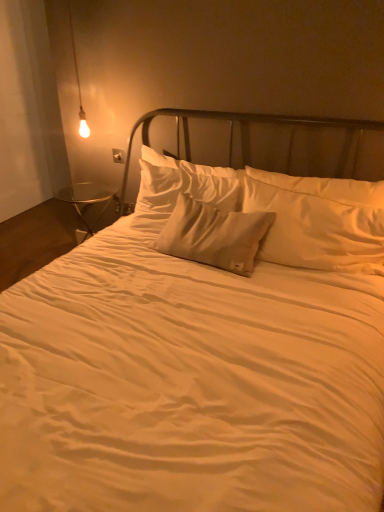
Question: Considering the relative positions of satin beige pillow at center, the 1th pillow viewed from the back, and matte plastic electric outlet at lower left, which is the 1th electric outlet in back-to-front order, in the image provided, is satin beige pillow at center, the 1th pillow viewed from the back, to the right of matte plastic electric outlet at lower left, which is the 1th electric outlet in back-to-front order, from the viewer's perspective?

Choices:
 (A) yes
 (B) no

Answer: (A)

Question: Is satin beige pillow at center, the 1th pillow viewed from the back, in front of matte plastic electric outlet at lower left, placed as the 1th electric outlet when sorted from bottom to top?

Choices:
 (A) no
 (B) yes

Answer: (B)

Question: Can we say satin beige pillow at center, the 1th pillow viewed from the back, lies outside matte plastic electric outlet at lower left, the second electric outlet from the top?

Choices:
 (A) yes
 (B) no

Answer: (A)

Question: Can you confirm if satin beige pillow at center, the 1th pillow viewed from the back, is thinner than matte plastic electric outlet at lower left, placed as the 1th electric outlet when sorted from bottom to top?

Choices:
 (A) yes
 (B) no

Answer: (B)

Question: From a real-world perspective, is satin beige pillow at center, placed as the 2th pillow when sorted from front to back, on top of matte plastic electric outlet at lower left, the 2th electric outlet viewed from the front?

Choices:
 (A) yes
 (B) no

Answer: (A)

Question: Looking at the image, does white plastic electric outlet at upper left, which is the 1th electric outlet from front to back, seem bigger or smaller compared to satin beige pillow at center, the 1th pillow viewed from the back?

Choices:
 (A) big
 (B) small

Answer: (B)

Question: Which is correct: white plastic electric outlet at upper left, which ranks as the first electric outlet in top-to-bottom order, is inside satin beige pillow at center, the 1th pillow viewed from the back, or outside of it?

Choices:
 (A) outside
 (B) inside

Answer: (A)

Question: From the image's perspective, is white plastic electric outlet at upper left, which is the 1th electric outlet from front to back, positioned above or below satin beige pillow at center, the 1th pillow viewed from the back?

Choices:
 (A) above
 (B) below

Answer: (A)

Question: Considering the positions of white plastic electric outlet at upper left, the 2th electric outlet from the bottom, and satin beige pillow at center, the 1th pillow viewed from the back, in the image, is white plastic electric outlet at upper left, the 2th electric outlet from the bottom, wider or thinner than satin beige pillow at center, the 1th pillow viewed from the back,?

Choices:
 (A) thin
 (B) wide

Answer: (A)

Question: From the image's perspective, relative to white plastic electric outlet at upper left, which ranks as the first electric outlet in top-to-bottom order, is satin beige pillow at center, which ranks as the first pillow in front-to-back order, above or below?

Choices:
 (A) below
 (B) above

Answer: (A)

Question: Is point (372, 216) positioned closer to the camera than point (112, 160)?

Choices:
 (A) closer
 (B) farther

Answer: (A)

Question: Is satin beige pillow at center, which ranks as the first pillow in front-to-back order, in front of or behind white plastic electric outlet at upper left, the 2th electric outlet viewed from the back, in the image?

Choices:
 (A) front
 (B) behind

Answer: (A)

Question: Would you say satin beige pillow at center, placed as the second pillow when sorted from back to front, is inside or outside white plastic electric outlet at upper left, the 2th electric outlet viewed from the back?

Choices:
 (A) inside
 (B) outside

Answer: (B)

Question: From a real-world perspective, is matte plastic electric outlet at lower left, the second electric outlet from the top, above or below matte glass bulb at upper left?

Choices:
 (A) above
 (B) below

Answer: (B)

Question: Would you say matte plastic electric outlet at lower left, the second electric outlet from the top, is inside or outside matte glass bulb at upper left?

Choices:
 (A) outside
 (B) inside

Answer: (A)